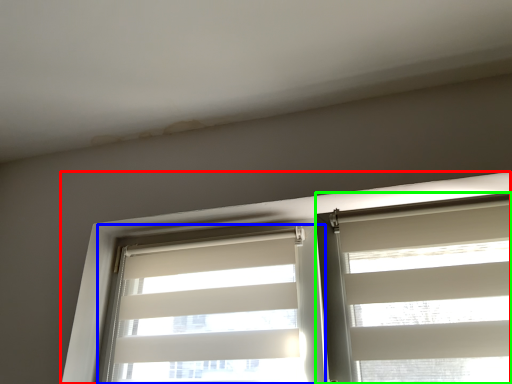
Question: Estimate the real-world distances between objects in this image. Which object is farther from window (highlighted by a red box), window blind (highlighted by a blue box) or window blind (highlighted by a green box)?

Choices:
 (A) window blind
 (B) window blind

Answer: (B)